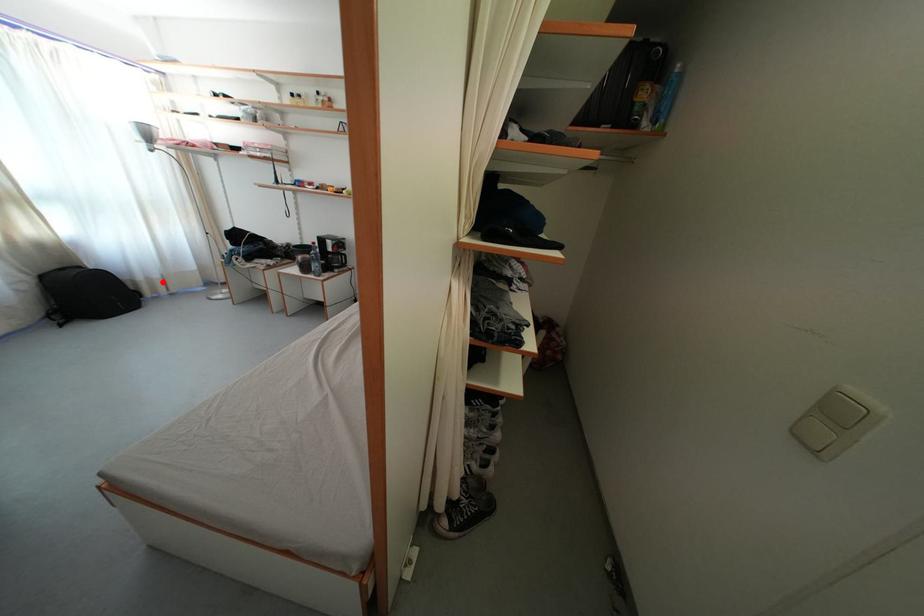
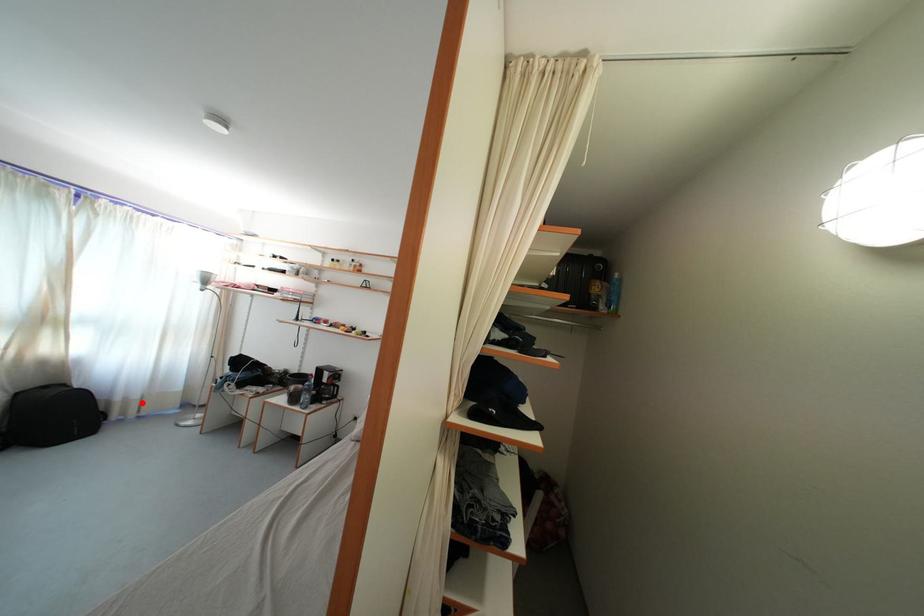
I am providing you with two images of the same scene from different viewpoints. A red point is marked on the first image and another point is marked on the second image. Does the point marked in image1 correspond to the same location as the one in image2?

Yes